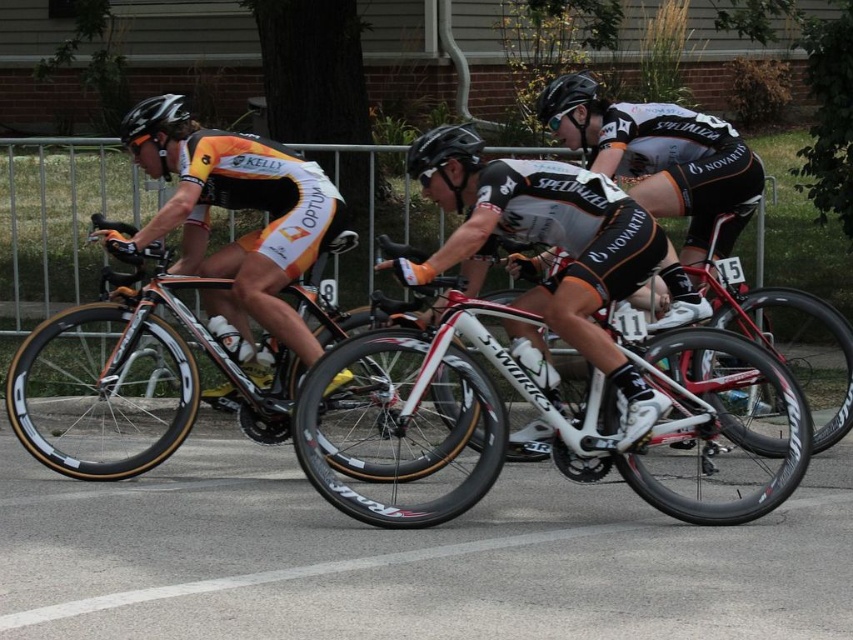
In the image of the cycling race, there are two points marked as point 1 at coordinates (x=175, y=93) and point 2 at coordinates (x=554, y=109). Which point is positioned further back from the front of the scene?

Point 1 at coordinates (x=175, y=93) is positioned further back from the front of the scene compared to point 2 at coordinates (x=554, y=109).

You are a photographer at the cycling race. You want to capture a closeup of the black matte helmet at upper left and the black matte bicycle helmet at center. Which helmet should you zoom in more on to ensure both are equally visible in the photo?

The black matte helmet at upper left is bigger than the black matte bicycle helmet at center, so you should zoom in more on the black matte bicycle helmet at center to balance their sizes in the photo.